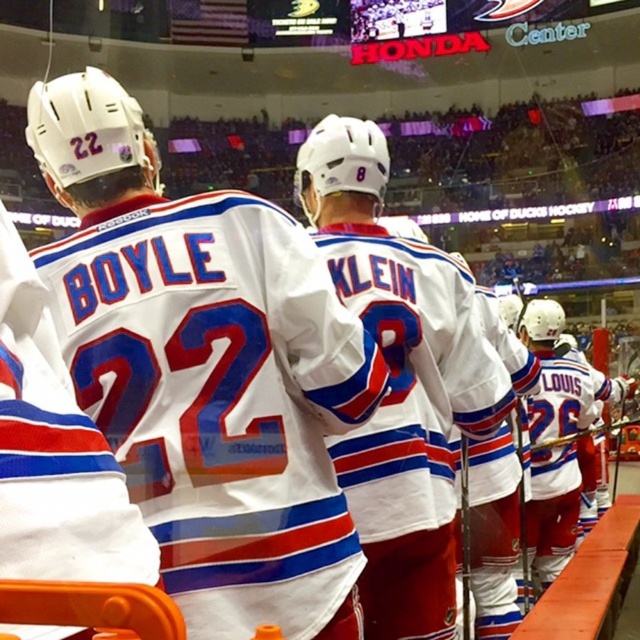
Does white matte jersey at center appear on the right side of white jersey at center?

No, white matte jersey at center is not to the right of white jersey at center.

Looking at this image, which is more to the right, white matte jersey at center or white jersey at center?

white jersey at center

What do you see at coordinates (205, 369) in the screenshot?
I see `white matte jersey at center` at bounding box center [205, 369].

The height and width of the screenshot is (640, 640). Identify the location of white matte jersey at center. (205, 369).